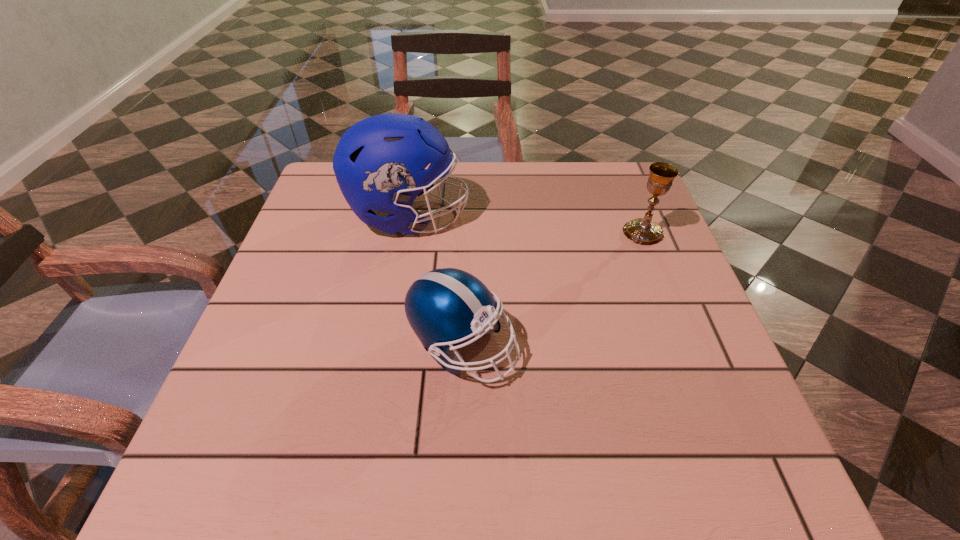
The height and width of the screenshot is (540, 960). What are the coordinates of `object that is positioned at the right edge` in the screenshot? It's located at (645, 231).

This screenshot has width=960, height=540. What are the coordinates of `object that is at the far left corner` in the screenshot? It's located at (379, 163).

Locate an element on the screen. The height and width of the screenshot is (540, 960). vacant space at the far edge of the desktop is located at coordinates (428, 197).

In the image, there is a desktop. What are the coordinates of `vacant area at the left edge` in the screenshot? It's located at (322, 376).

Identify the location of vacant space at the right edge. (704, 330).

In the image, there is a desktop. At what (x,y) coordinates should I click in order to perform the action: click on vacant space at the near left corner. Please return your answer as a coordinate pair (x, y). Image resolution: width=960 pixels, height=540 pixels. Looking at the image, I should click on (231, 438).

This screenshot has width=960, height=540. In the image, there is a desktop. What are the coordinates of `vacant space at the far right corner` in the screenshot? It's located at (638, 202).

You are a GUI agent. You are given a task and a screenshot of the screen. Output one action in this format:
    pyautogui.click(x=<x>, y=<y>)
    Task: Click on the vacant space at the near right corner of the desktop
    This screenshot has height=540, width=960.
    Given the screenshot: What is the action you would take?
    pyautogui.click(x=677, y=473)

This screenshot has width=960, height=540. What are the coordinates of `vacant region between the rightmost object and the shorter football helmet` in the screenshot? It's located at (553, 289).

This screenshot has width=960, height=540. I want to click on empty space that is in between the nearest object and the chalice, so click(553, 289).